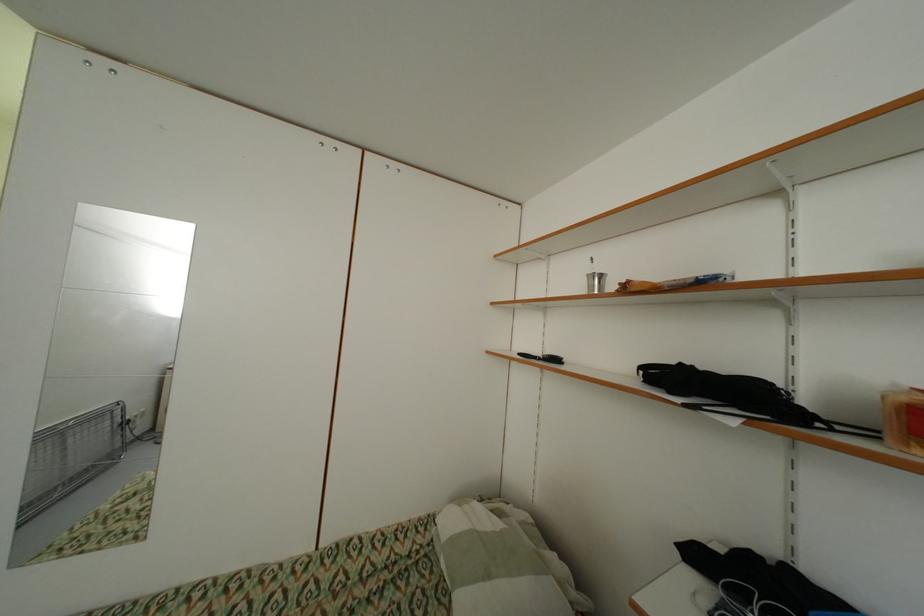
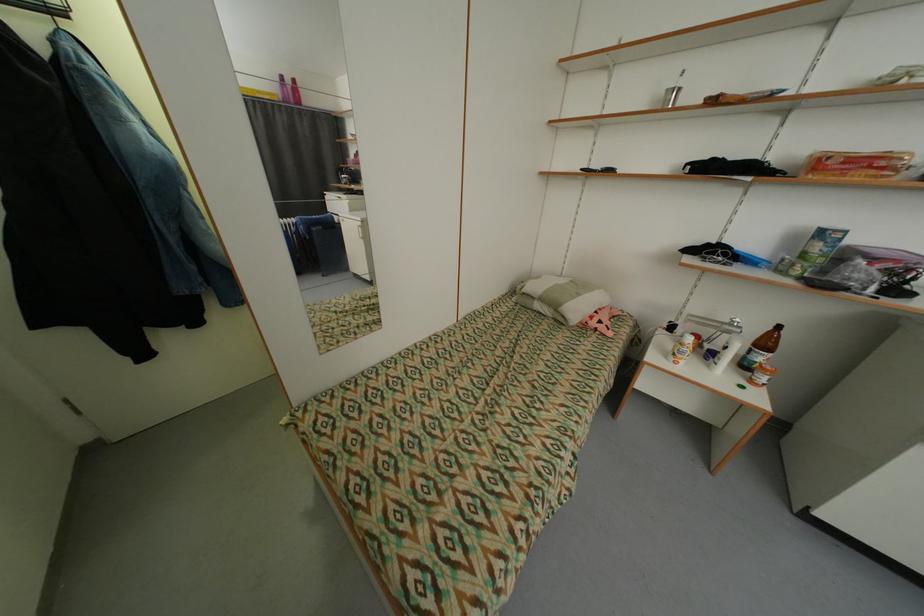
Where in the second image is the point corresponding to (494,577) from the first image?

(585, 296)